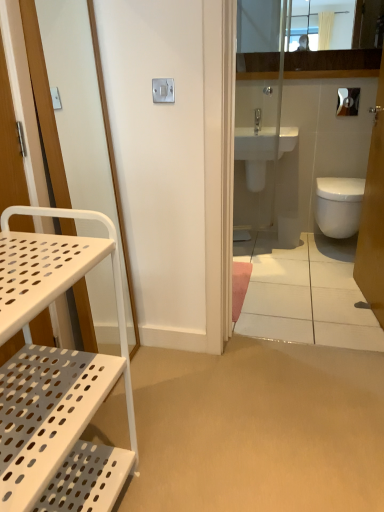
The height and width of the screenshot is (512, 384). In order to click on vacant area to the right of white perforated shelf at left, which is the first screen door from left to right in this screenshot , I will do `click(164, 373)`.